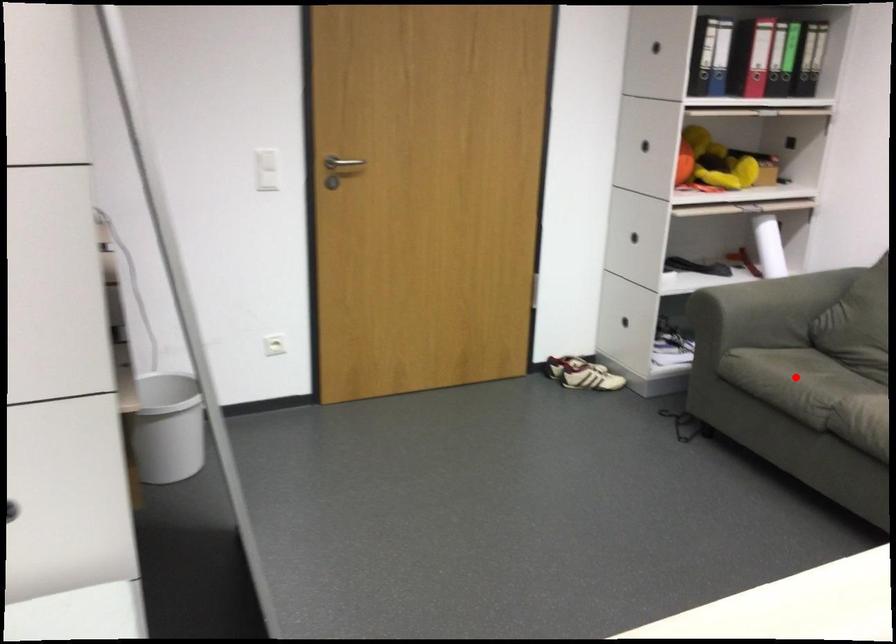
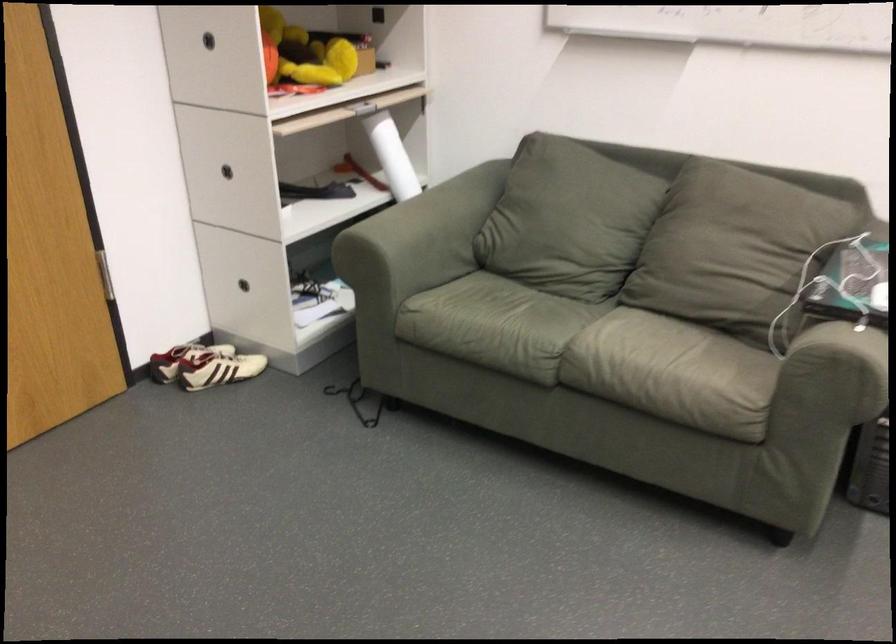
Question: I am providing you with two images of the same scene from different viewpoints. Given a red point in image1, look at the same physical point in image2. Is it:

Choices:
 (A) Closer to the viewpoint
 (B) Farther from the viewpoint

Answer: (A)